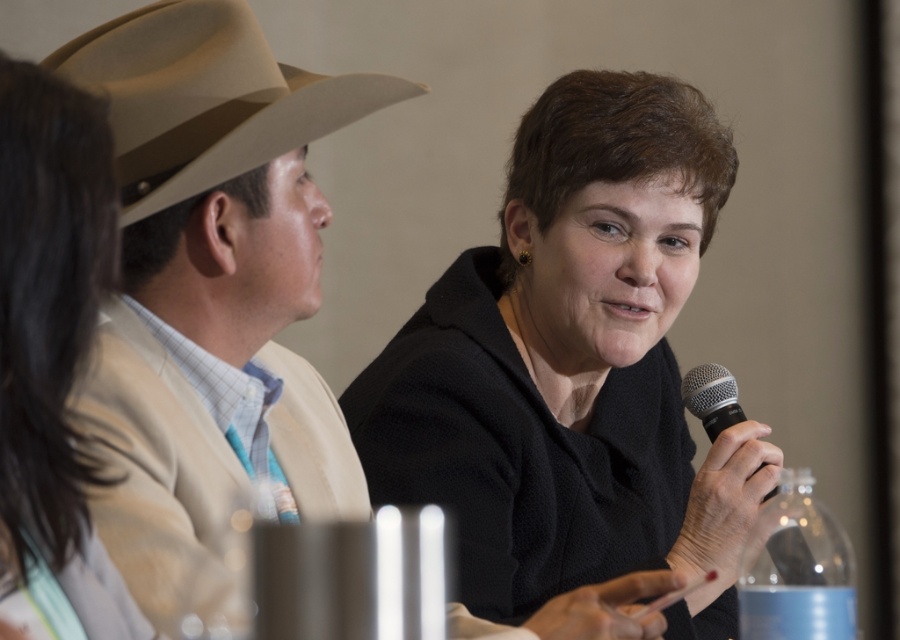
Does point (227, 454) come closer to viewer compared to point (716, 388)?

Yes, point (227, 454) is in front of point (716, 388).

Does beige fabric cowboy hat at upper left have a lesser width compared to silver metallic microphone at center?

Incorrect, beige fabric cowboy hat at upper left's width is not less than silver metallic microphone at center's.

Between point (184, 493) and point (734, 406), which one is positioned in front?

Positioned in front is point (184, 493).

This screenshot has width=900, height=640. I want to click on beige fabric cowboy hat at upper left, so click(x=213, y=292).

Which is more to the right, brown leather hat at upper left or tan felt cowboy hat at left?

Positioned to the right is tan felt cowboy hat at left.

Is brown leather hat at upper left closer to the viewer compared to tan felt cowboy hat at left?

Yes, it is.

Who is more forward, (109,611) or (270,93)?

Point (109,611) is in front.

Where is `brown leather hat at upper left`? The width and height of the screenshot is (900, 640). brown leather hat at upper left is located at coordinates (52, 348).

Can you confirm if tan felt cowboy hat at left is positioned to the left of silver metallic microphone at center?

Correct, you'll find tan felt cowboy hat at left to the left of silver metallic microphone at center.

From the picture: Does tan felt cowboy hat at left have a greater height compared to silver metallic microphone at center?

Yes.

Which is behind, point (110, 124) or point (716, 410)?

The point (716, 410) is more distant.

What are the coordinates of `tan felt cowboy hat at left` in the screenshot? It's located at (205, 97).